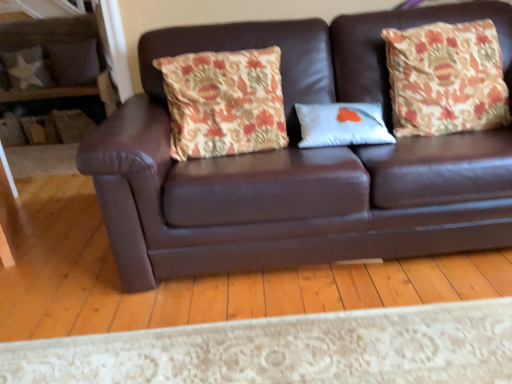
Question: From the image's perspective, is floral fabric pillow at right, arranged as the second throw pillow when viewed from the left, above brown leather couch at center?

Choices:
 (A) no
 (B) yes

Answer: (B)

Question: From the image's perspective, is floral fabric pillow at right, arranged as the second throw pillow when viewed from the left, beneath brown leather couch at center?

Choices:
 (A) no
 (B) yes

Answer: (A)

Question: Is floral fabric pillow at right, arranged as the 1th throw pillow when viewed from the right, oriented towards brown leather couch at center?

Choices:
 (A) no
 (B) yes

Answer: (B)

Question: Is brown leather couch at center located within floral fabric pillow at right, arranged as the 1th throw pillow when viewed from the right?

Choices:
 (A) no
 (B) yes

Answer: (A)

Question: Is floral fabric pillow at right, arranged as the 1th throw pillow when viewed from the right, positioned beyond the bounds of brown leather couch at center?

Choices:
 (A) yes
 (B) no

Answer: (B)

Question: From a real-world perspective, is floral fabric pillow at right, arranged as the 1th throw pillow when viewed from the right, on brown leather couch at center?

Choices:
 (A) no
 (B) yes

Answer: (B)

Question: Is brown leather couch at center far away from floral fabric pillow at right, arranged as the 1th throw pillow when viewed from the right?

Choices:
 (A) no
 (B) yes

Answer: (A)

Question: From the image's perspective, is brown leather couch at center on floral fabric pillow at right, arranged as the 1th throw pillow when viewed from the right?

Choices:
 (A) yes
 (B) no

Answer: (B)

Question: Is brown leather couch at center outside of floral fabric pillow at right, arranged as the second throw pillow when viewed from the left?

Choices:
 (A) no
 (B) yes

Answer: (B)

Question: Is brown leather couch at center taller than floral fabric pillow at right, arranged as the 1th throw pillow when viewed from the right?

Choices:
 (A) no
 (B) yes

Answer: (B)

Question: Does brown leather couch at center appear on the left side of floral fabric pillow at right, arranged as the second throw pillow when viewed from the left?

Choices:
 (A) yes
 (B) no

Answer: (A)

Question: From a real-world perspective, is brown leather couch at center positioned over floral fabric pillow at right, arranged as the 1th throw pillow when viewed from the right, based on gravity?

Choices:
 (A) no
 (B) yes

Answer: (A)

Question: Is floral fabric pillow at right, arranged as the second throw pillow when viewed from the left, next to camouflage fabric pillow at upper left, which appears as the second pillow when ordered from the bottom?

Choices:
 (A) no
 (B) yes

Answer: (A)